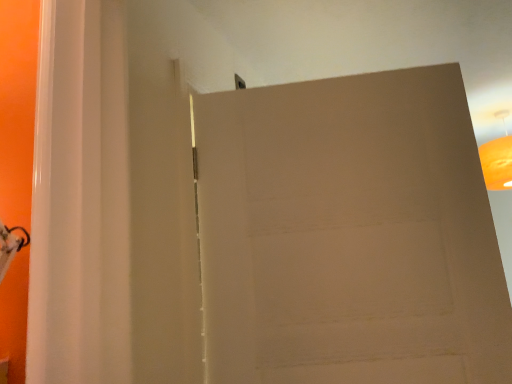
Describe the element at coordinates (349, 234) in the screenshot. The height and width of the screenshot is (384, 512). I see `matte brown door at upper center` at that location.

Locate an element on the screen. The height and width of the screenshot is (384, 512). matte brown door at upper center is located at coordinates (349, 234).

Measure the distance between orange matte lampshade at upper right and camera.

A distance of 8.16 feet exists between orange matte lampshade at upper right and camera.

In order to face orange matte lampshade at upper right, should I rotate leftwards or rightwards?

To face it directly, rotate right by 30.749 degrees.

What do you see at coordinates (498, 158) in the screenshot? I see `orange matte lampshade at upper right` at bounding box center [498, 158].

Identify the location of orange matte lampshade at upper right. (498, 158).

The height and width of the screenshot is (384, 512). I want to click on matte brown door at upper center, so click(349, 234).

Between matte brown door at upper center and orange matte lampshade at upper right, which one appears on the right side from the viewer's perspective?

From the viewer's perspective, orange matte lampshade at upper right appears more on the right side.

Is matte brown door at upper center in front of or behind orange matte lampshade at upper right in the image?

matte brown door at upper center is positioned closer to the viewer than orange matte lampshade at upper right.

Does point (417, 103) come closer to viewer compared to point (507, 135)?

Yes.

Consider the image. From the image's perspective, relative to orange matte lampshade at upper right, is matte brown door at upper center above or below?

From the image's perspective, matte brown door at upper center appears below orange matte lampshade at upper right.

From a real-world perspective, is matte brown door at upper center beneath orange matte lampshade at upper right?

Yes, from a real-world perspective, matte brown door at upper center is beneath orange matte lampshade at upper right.

Considering the relative sizes of matte brown door at upper center and orange matte lampshade at upper right in the image provided, is matte brown door at upper center thinner than orange matte lampshade at upper right?

Indeed, matte brown door at upper center has a lesser width compared to orange matte lampshade at upper right.

Considering the relative sizes of matte brown door at upper center and orange matte lampshade at upper right in the image provided, is matte brown door at upper center shorter than orange matte lampshade at upper right?

No, matte brown door at upper center is not shorter than orange matte lampshade at upper right.

Considering the sizes of objects matte brown door at upper center and orange matte lampshade at upper right in the image provided, who is bigger, matte brown door at upper center or orange matte lampshade at upper right?

Bigger between the two is matte brown door at upper center.

Is matte brown door at upper center spatially inside orange matte lampshade at upper right, or outside of it?

matte brown door at upper center is spatially situated outside orange matte lampshade at upper right.

Is matte brown door at upper center placed right next to orange matte lampshade at upper right?

matte brown door at upper center and orange matte lampshade at upper right are clearly separated.

Could you tell me if matte brown door at upper center is turned towards orange matte lampshade at upper right?

No, matte brown door at upper center does not turn towards orange matte lampshade at upper right.

Can you tell me how much matte brown door at upper center and orange matte lampshade at upper right differ in facing direction?

matte brown door at upper center and orange matte lampshade at upper right are facing 124 degrees away from each other.

How distant is matte brown door at upper center from orange matte lampshade at upper right?

matte brown door at upper center and orange matte lampshade at upper right are 1.73 meters apart.

Find the location of a particular element. door below the orange matte lampshade at upper right (from a real-world perspective) is located at coordinates (349, 234).

Does orange matte lampshade at upper right appear on the right side of matte brown door at upper center?

Yes, orange matte lampshade at upper right is to the right of matte brown door at upper center.

Is the depth of orange matte lampshade at upper right less than that of matte brown door at upper center?

That is False.

Which is closer, [506,155] or [507,368]?

Point [507,368]

From the image's perspective, is orange matte lampshade at upper right located beneath matte brown door at upper center?

No.

From a real-world perspective, is orange matte lampshade at upper right positioned under matte brown door at upper center based on gravity?

Actually, orange matte lampshade at upper right is physically above matte brown door at upper center in the real world.

Considering the relative sizes of orange matte lampshade at upper right and matte brown door at upper center in the image provided, is orange matte lampshade at upper right wider than matte brown door at upper center?

Correct, the width of orange matte lampshade at upper right exceeds that of matte brown door at upper center.

Can you confirm if orange matte lampshade at upper right is shorter than matte brown door at upper center?

Yes.

Can you confirm if orange matte lampshade at upper right is bigger than matte brown door at upper center?

Actually, orange matte lampshade at upper right might be smaller than matte brown door at upper center.

Is orange matte lampshade at upper right positioned beyond the bounds of matte brown door at upper center?

Indeed, orange matte lampshade at upper right is completely outside matte brown door at upper center.

Would you consider orange matte lampshade at upper right to be distant from matte brown door at upper center?

Yes, orange matte lampshade at upper right and matte brown door at upper center are quite far apart.

Is orange matte lampshade at upper right positioned with its back to matte brown door at upper center?

No.

Locate an element on the screen. This screenshot has height=384, width=512. lamp on the right side of matte brown door at upper center is located at coordinates (498, 158).

The height and width of the screenshot is (384, 512). What are the coordinates of `lamp behind the matte brown door at upper center` in the screenshot? It's located at tap(498, 158).

Locate an element on the screen. This screenshot has height=384, width=512. door in front of the orange matte lampshade at upper right is located at coordinates (349, 234).